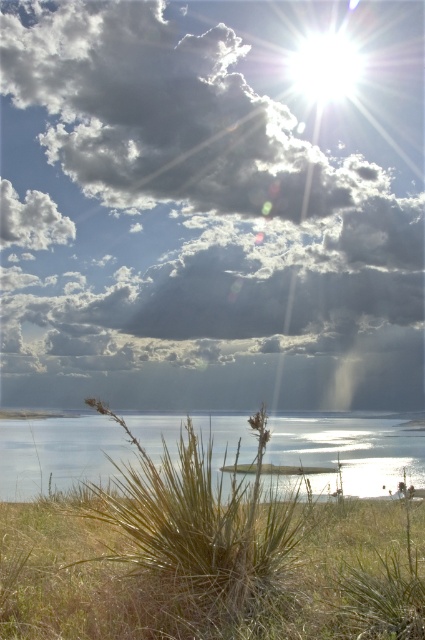
You are standing in the natural landscape described. Looking towards the cloudy sky at upper center and the green grass at lower left, which one appears taller from your viewpoint?

The cloudy sky at upper center appears taller than the green grass at lower left because it has a greater height in the scene.

You are standing in the natural landscape described. Looking towards the cloudy sky at upper center, which direction should you turn to face the green grass at lower left?

You should turn to your left because the cloudy sky at upper center is positioned over green grass at lower left, indicating the grass is located below the sky in the lower left direction from your current facing.

You are standing in the middle of the grassy area and want to reach the clear water at lower center without stepping on the green textured grass at lower center. Which direction should you move?

You should move to the right because the green textured grass at lower center is to the left of the clear water at lower center, so moving right would avoid stepping on it.